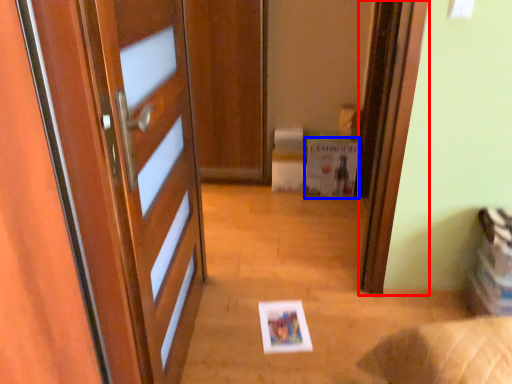
Question: Which point is further to the camera, screen door (highlighted by a red box) or postcard (highlighted by a blue box)?

Choices:
 (A) screen door
 (B) postcard

Answer: (B)